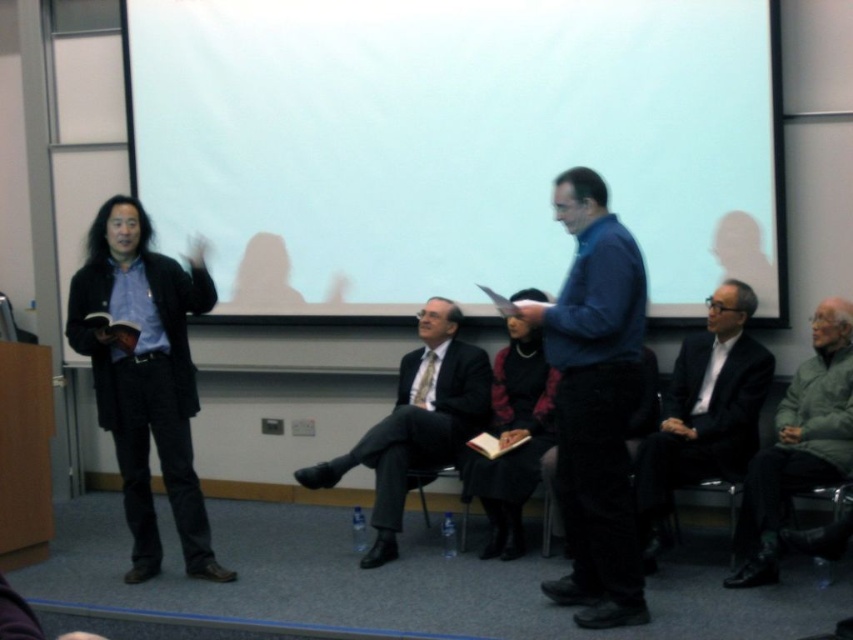
In the conference room scene, there are two men wearing a dark gray suit at center and a matte black suit at center. Which one is standing to the right of the other?

The dark gray suit at center is positioned on the right side of matte black suit at center.

You are an event planner arranging seating for a panel discussion. You need to place a name tag on the table in front of each speaker. According to the image, which speaker should have their name tag placed higher on the table? The blue fabric shirt at center or the dark gray suit at center?

The blue fabric shirt at center should have its name tag placed higher on the table because the blue fabric shirt at center is above dark gray suit at center in the image.

In the conference room scene, there are two men standing. One is wearing a dark suit and the other has a blue sweater. Where is the point located at coordinates (704, 412) in relation to their clothing?

The point at coordinates (704, 412) corresponds to the dark gray suit at center, which is the clothing of the man on the left who is presenting with an open book.